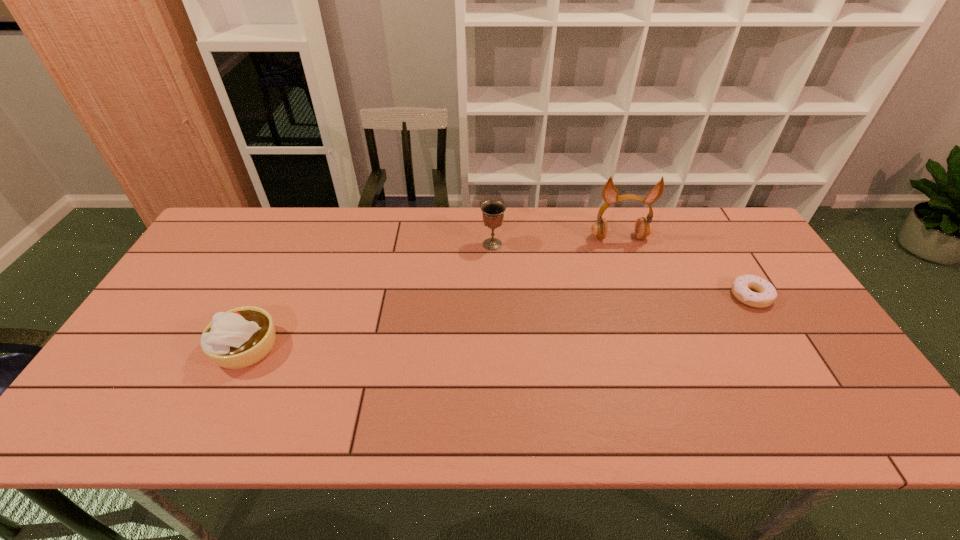
Find the location of a particular element. This screenshot has width=960, height=540. the tallest object is located at coordinates (643, 228).

Identify the location of earphone. (643, 228).

In order to click on the third shortest object in this screenshot , I will do `click(493, 211)`.

You are a GUI agent. You are given a task and a screenshot of the screen. Output one action in this format:
    pyautogui.click(x=<x>, y=<y>)
    Task: Click on the chalice
    This screenshot has width=960, height=540.
    Given the screenshot: What is the action you would take?
    pyautogui.click(x=493, y=211)

This screenshot has width=960, height=540. In order to click on the nearest object in this screenshot , I will do `click(238, 338)`.

Where is `whipped cream`? whipped cream is located at coordinates (238, 338).

Identify the location of the third farthest object. (741, 286).

At what (x,y) coordinates should I click in order to perform the action: click on doughnut. Please return your answer as a coordinate pair (x, y). The image size is (960, 540). Looking at the image, I should click on (741, 286).

I want to click on vacant space situated 0.220m on the front-facing side of the earphone, so click(639, 296).

The height and width of the screenshot is (540, 960). What are the coordinates of `blank space located 0.090m on the front of the second tallest object` in the screenshot? It's located at (493, 272).